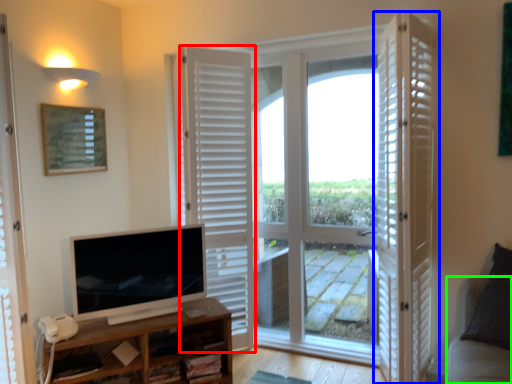
Question: Based on their relative distances, which object is farther from door (highlighted by a red box)? Choose from door (highlighted by a blue box) and couch (highlighted by a green box).

Choices:
 (A) door
 (B) couch

Answer: (B)